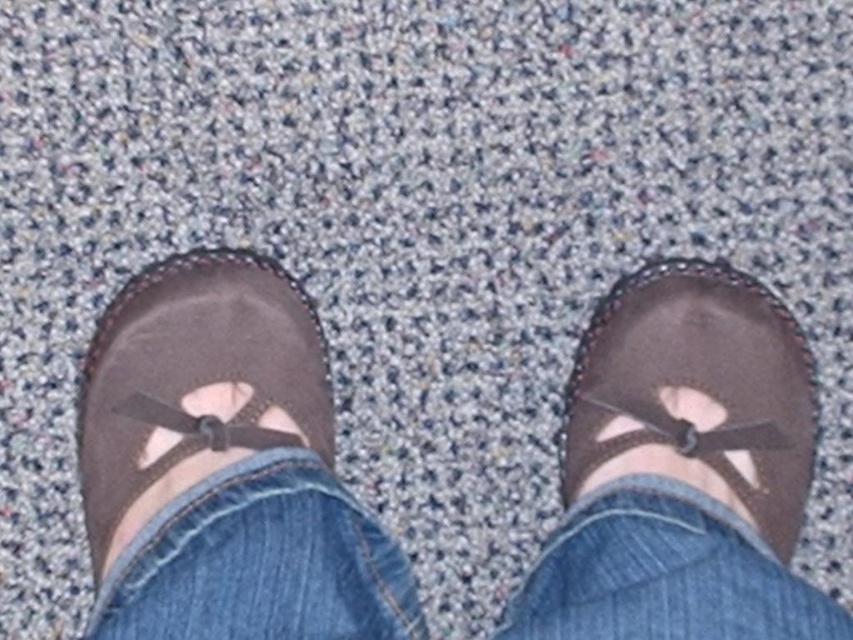
Looking at this image, is denim at center below brown leather shoe at center?

Yes.

Who is positioned more to the right, denim at center or brown leather shoe at center?

From the viewer's perspective, brown leather shoe at center appears more on the right side.

You are a GUI agent. You are given a task and a screenshot of the screen. Output one action in this format:
    pyautogui.click(x=<x>, y=<y>)
    Task: Click on the denim at center
    The height and width of the screenshot is (640, 853).
    Given the screenshot: What is the action you would take?
    pyautogui.click(x=260, y=563)

The image size is (853, 640). I want to click on denim at center, so click(260, 563).

Who is more distant from viewer, (666,339) or (262,449)?

Positioned behind is point (666,339).

Consider the image. Between brown leather shoe at center and brown suede shoe at left, which one has more height?

brown suede shoe at left

Between point (772, 387) and point (99, 468), which one is positioned in front?

Positioned in front is point (99, 468).

This screenshot has width=853, height=640. I want to click on brown leather shoe at center, so click(698, 387).

Who is higher up, brown suede shoes at center or brown suede shoe at left?

Positioned higher is brown suede shoe at left.

Between brown suede shoes at center and brown suede shoe at left, which one is positioned lower?

brown suede shoes at center

This screenshot has width=853, height=640. What do you see at coordinates (224, 467) in the screenshot?
I see `brown suede shoes at center` at bounding box center [224, 467].

Where is `brown suede shoes at center`? brown suede shoes at center is located at coordinates (224, 467).